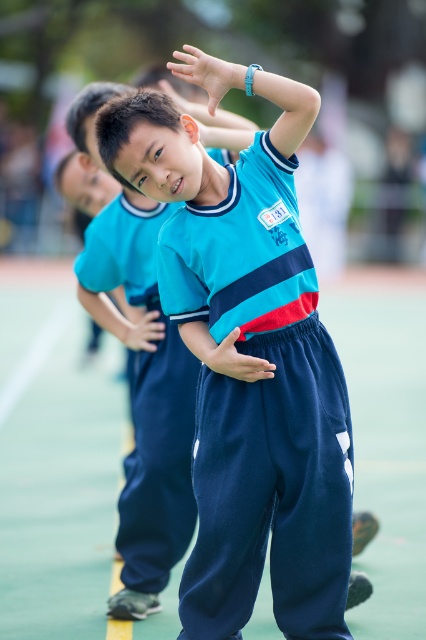
You are a photographer standing 5 meters away from the blue fabric uniform at center. You want to take a closeup shot of it. Do you need to move closer or farther away?

The blue fabric uniform at center is 4.03 meters from camera. Since you are currently 5 meters away, you need to move 0.97 meters closer to reach the 4.03 meter distance for the closeup shot.

You are a photographer trying to capture the perfect shot of the blue fabric uniform at center and the matte blue hand at upper center. To ensure both are in frame, should you adjust your camera to the left or right?

The blue fabric uniform at center is to the left of matte blue hand at upper center, so you should adjust your camera to the right to include both in the frame.

You are observing a group of children exercising outdoors. You notice two objects labeled as the matte blue hand at center and the matte blue hand at upper center. Based on their positions, which one is located lower in the image?

The matte blue hand at center is located below the matte blue hand at upper center, so the matte blue hand at center is lower in the image.